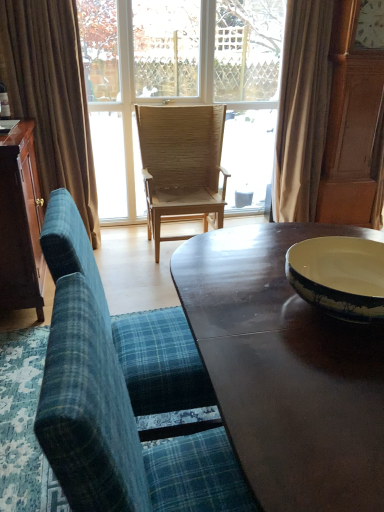
Image resolution: width=384 pixels, height=512 pixels. What are the coordinates of `wooden chair at center, which is the 2th chair from front to back` in the screenshot? It's located at (130, 324).

The height and width of the screenshot is (512, 384). What do you see at coordinates (130, 324) in the screenshot?
I see `wooden chair at center, which is the 2th chair from front to back` at bounding box center [130, 324].

What do you see at coordinates (339, 276) in the screenshot? The width and height of the screenshot is (384, 512). I see `yellow ceramic bowl at right` at bounding box center [339, 276].

The height and width of the screenshot is (512, 384). In order to click on wooden woven chair at center, the third chair viewed from the front in this screenshot , I will do `click(181, 164)`.

Measure the distance between point (18, 7) and camera.

A distance of 8.60 feet exists between point (18, 7) and camera.

I want to click on wooden chair at center, the second chair positioned from the back, so click(x=130, y=324).

Is shiny dark wood coffee table at center further to camera compared to blue plaid fabric chair at lower left, the 1th chair positioned from the front?

Yes, shiny dark wood coffee table at center is further from the camera.

Which is correct: shiny dark wood coffee table at center is inside blue plaid fabric chair at lower left, which is the 3th chair in back-to-front order, or outside of it?

shiny dark wood coffee table at center lies outside blue plaid fabric chair at lower left, which is the 3th chair in back-to-front order.

Does point (310, 446) come behind point (80, 288)?

No, it is not.

Who is shorter, shiny dark wood coffee table at center or blue plaid fabric chair at lower left, which is the 3th chair in back-to-front order?

shiny dark wood coffee table at center.

Is brown fabric curtain at left, marked as the first curtain in a left-to-right arrangement, next to yellow ceramic bowl at right and touching it?

No, brown fabric curtain at left, marked as the first curtain in a left-to-right arrangement, is not in contact with yellow ceramic bowl at right.

Is brown fabric curtain at left, which is the 2th curtain from right to left, closer to camera compared to yellow ceramic bowl at right?

No, brown fabric curtain at left, which is the 2th curtain from right to left, is behind yellow ceramic bowl at right.

Can you confirm if brown fabric curtain at left, which is the 2th curtain from right to left, is smaller than yellow ceramic bowl at right?

No, brown fabric curtain at left, which is the 2th curtain from right to left, is not smaller than yellow ceramic bowl at right.

Locate an element on the screen. The width and height of the screenshot is (384, 512). bowl directly beneath the brown fabric curtain at left, which is the 2th curtain from right to left (from a real-world perspective) is located at coordinates (339, 276).

Considering the sizes of objects wooden chair at center, which is the 2th chair from front to back, and clear glass window at center in the image provided, who is taller, wooden chair at center, which is the 2th chair from front to back, or clear glass window at center?

clear glass window at center.

Does wooden chair at center, which is the 2th chair from front to back, appear on the right side of clear glass window at center?

No, wooden chair at center, which is the 2th chair from front to back, is not to the right of clear glass window at center.

From a real-world perspective, is wooden chair at center, which is the 2th chair from front to back, located beneath clear glass window at center?

Yes, from a real-world perspective, wooden chair at center, which is the 2th chair from front to back, is under clear glass window at center.

From a real-world perspective, is dark brown wood cabinet at left physically above brown fabric curtain at left, marked as the first curtain in a left-to-right arrangement?

Incorrect, from a real-world perspective, dark brown wood cabinet at left is lower than brown fabric curtain at left, marked as the first curtain in a left-to-right arrangement.

Can brown fabric curtain at left, marked as the first curtain in a left-to-right arrangement, be found inside dark brown wood cabinet at left?

No, brown fabric curtain at left, marked as the first curtain in a left-to-right arrangement, is not a part of dark brown wood cabinet at left.

Where is `cabinetry in front of the brown fabric curtain at left, which is the 2th curtain from right to left`? cabinetry in front of the brown fabric curtain at left, which is the 2th curtain from right to left is located at coordinates (20, 223).

Is point (298, 266) closer or farther from the camera than point (137, 121)?

Point (298, 266) is positioned closer to the camera compared to point (137, 121).

Is yellow ceramic bowl at right with wooden woven chair at center, the third chair viewed from the front?

No.

Between yellow ceramic bowl at right and wooden woven chair at center, the third chair viewed from the front, which one has more height?

Standing taller between the two is wooden woven chair at center, the third chair viewed from the front.

Is yellow ceramic bowl at right positioned with its back to wooden woven chair at center, which is counted as the 1th chair, starting from the back?

yellow ceramic bowl at right is not turned away from wooden woven chair at center, which is counted as the 1th chair, starting from the back.

Who is more distant, wooden chair at center, which is the 2th chair from front to back, or blue plaid fabric chair at lower left, the 1th chair positioned from the front?

Positioned behind is wooden chair at center, which is the 2th chair from front to back.

From the image's perspective, is wooden chair at center, the second chair positioned from the back, beneath blue plaid fabric chair at lower left, which is the 3th chair in back-to-front order?

No, from the image's perspective, wooden chair at center, the second chair positioned from the back, is not below blue plaid fabric chair at lower left, which is the 3th chair in back-to-front order.

From a real-world perspective, is wooden chair at center, which is the 2th chair from front to back, physically located above or below blue plaid fabric chair at lower left, the 1th chair positioned from the front?

From a real-world perspective, wooden chair at center, which is the 2th chair from front to back, is physically above blue plaid fabric chair at lower left, the 1th chair positioned from the front.

Is wooden chair at center, the second chair positioned from the back, thinner than blue plaid fabric chair at lower left, the 1th chair positioned from the front?

No, wooden chair at center, the second chair positioned from the back, is not thinner than blue plaid fabric chair at lower left, the 1th chair positioned from the front.

Considering the relative sizes of shiny dark wood coffee table at center and wooden chair at center, the second chair positioned from the back, in the image provided, is shiny dark wood coffee table at center thinner than wooden chair at center, the second chair positioned from the back,?

In fact, shiny dark wood coffee table at center might be wider than wooden chair at center, the second chair positioned from the back.

This screenshot has height=512, width=384. I want to click on coffee table located below the wooden chair at center, which is the 2th chair from front to back (from the image's perspective), so click(x=286, y=370).

Is shiny dark wood coffee table at center not inside wooden chair at center, which is the 2th chair from front to back?

Yes.

Identify the location of coffee table above the blue plaid fabric chair at lower left, which is the 3th chair in back-to-front order (from the image's perspective). This screenshot has height=512, width=384. (286, 370).

Where is `bowl on the right of brown fabric curtain at left, which is the 2th curtain from right to left`? The height and width of the screenshot is (512, 384). bowl on the right of brown fabric curtain at left, which is the 2th curtain from right to left is located at coordinates (339, 276).

From the image, which object appears to be farther from wooden woven chair at center, which is counted as the 1th chair, starting from the back, dark brown wood cabinet at left or yellow ceramic bowl at right?

yellow ceramic bowl at right.

When comparing their distances from yellow ceramic bowl at right, does blue plaid fabric chair at lower left, the 1th chair positioned from the front, or wooden chair at center, which is the 2th chair from front to back, seem closer?

Based on the image, wooden chair at center, which is the 2th chair from front to back, appears to be nearer to yellow ceramic bowl at right.

When comparing their distances from wooden chair at center, which is the 2th chair from front to back, does shiny dark wood coffee table at center or clear glass window at center seem further?

clear glass window at center is positioned further to the anchor wooden chair at center, which is the 2th chair from front to back.

Based on their spatial positions, is dark brown wood cabinet at left or yellow ceramic bowl at right closer to blue plaid fabric chair at lower left, which is the 3th chair in back-to-front order?

yellow ceramic bowl at right is closer to blue plaid fabric chair at lower left, which is the 3th chair in back-to-front order.

Estimate the real-world distances between objects in this image. Which object is further from wooden woven chair at center, the third chair viewed from the front, dark brown wood cabinet at left or wooden chair at center, which is the 2th chair from front to back?

wooden chair at center, which is the 2th chair from front to back, lies further to wooden woven chair at center, the third chair viewed from the front, than the other object.

Considering their positions, is yellow ceramic bowl at right positioned further to dark brown wood cabinet at left than brown fabric curtain at left, marked as the first curtain in a left-to-right arrangement?

yellow ceramic bowl at right lies further to dark brown wood cabinet at left than the other object.

Estimate the real-world distances between objects in this image. Which object is closer to clear glass window at center, wooden chair at center, the second chair positioned from the back, or wooden woven chair at center, which is counted as the 1th chair, starting from the back?

wooden woven chair at center, which is counted as the 1th chair, starting from the back, is closer to clear glass window at center.

Which object lies nearer to the anchor point shiny dark wood coffee table at center, blue plaid fabric chair at lower left, the 1th chair positioned from the front, or beige fabric curtain at upper right, which is the 1th curtain in right-to-left order?

blue plaid fabric chair at lower left, the 1th chair positioned from the front, is positioned closer to the anchor shiny dark wood coffee table at center.

You are a GUI agent. You are given a task and a screenshot of the screen. Output one action in this format:
    pyautogui.click(x=<x>, y=<y>)
    Task: Click on the coffee table between blue plaid fabric chair at lower left, which is the 3th chair in back-to-front order, and clear glass window at center from front to back
    This screenshot has width=384, height=512.
    Given the screenshot: What is the action you would take?
    pyautogui.click(x=286, y=370)

In order to click on cabinetry between yellow ceramic bowl at right and wooden woven chair at center, the third chair viewed from the front, from front to back in this screenshot , I will do `click(20, 223)`.

Identify the location of window located between dark brown wood cabinet at left and beige fabric curtain at upper right, the second curtain viewed from the left, in the left-right direction. The width and height of the screenshot is (384, 512). (179, 83).

The height and width of the screenshot is (512, 384). In order to click on bowl located between blue plaid fabric chair at lower left, the 1th chair positioned from the front, and clear glass window at center in the depth direction in this screenshot , I will do `click(339, 276)`.